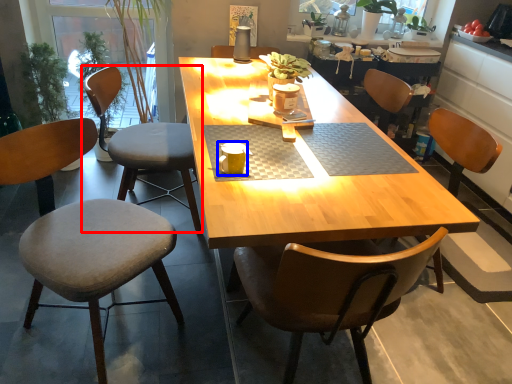
Question: Among these objects, which one is farthest to the camera, chair (highlighted by a red box) or coffee cup (highlighted by a blue box)?

Choices:
 (A) chair
 (B) coffee cup

Answer: (A)